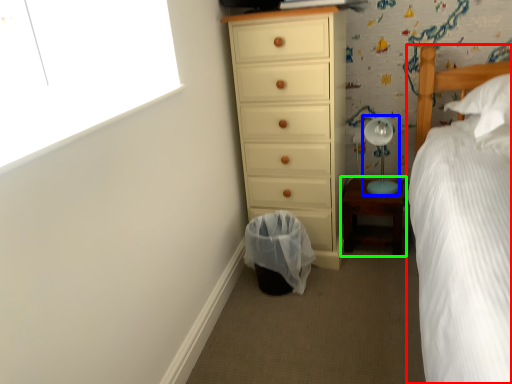
Question: Considering the real-world distances, which object is closest to bed (highlighted by a red box)? table lamp (highlighted by a blue box) or nightstand (highlighted by a green box).

Choices:
 (A) table lamp
 (B) nightstand

Answer: (A)